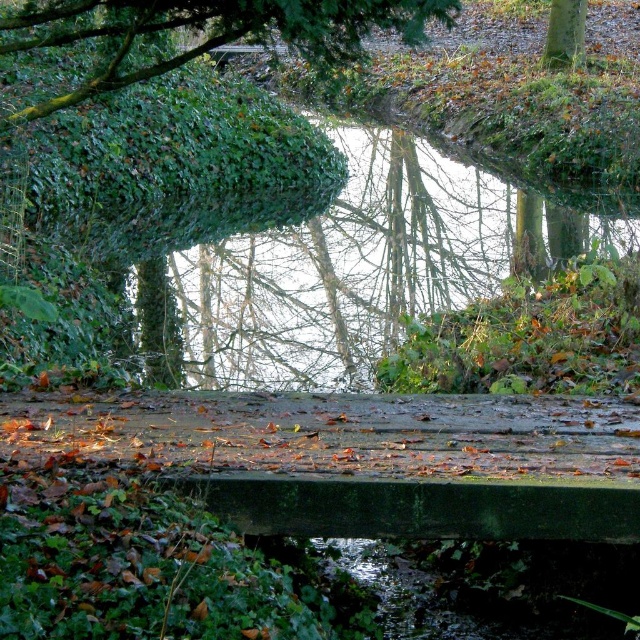
Can you confirm if green leafy stream at center is smaller than green leafy tree at upper left?

No.

Who is more distant from viewer, [257,237] or [330,54]?

Point [257,237]

The height and width of the screenshot is (640, 640). Identify the location of green leafy stream at center. (360, 266).

Locate an element on the screen. This screenshot has width=640, height=640. green leafy stream at center is located at coordinates (360, 266).

Where is `green leafy tree at upper left`? The height and width of the screenshot is (640, 640). green leafy tree at upper left is located at coordinates (209, 33).

Who is lower down, green leafy tree at upper left or green rough bark tree at upper right?

green leafy tree at upper left is below.

What are the coordinates of `green leafy tree at upper left` in the screenshot? It's located at (209, 33).

The width and height of the screenshot is (640, 640). Identify the location of green leafy tree at upper left. (209, 33).

Does green leafy stream at center have a larger size compared to green leafy tree at upper center?

Yes.

Between green leafy stream at center and green leafy tree at upper center, which one appears on the right side from the viewer's perspective?

Positioned to the right is green leafy stream at center.

Is point (291, 314) positioned in front of point (35, 45)?

No, it is not.

This screenshot has height=640, width=640. I want to click on green leafy stream at center, so click(360, 266).